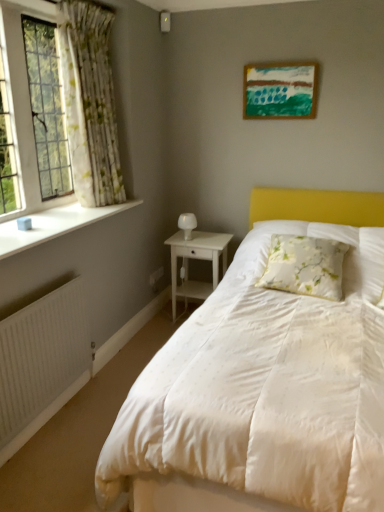
Locate an element on the screen. white glossy table lamp at center is located at coordinates (187, 224).

Measure the distance between floral fabric pillow at center and camera.

floral fabric pillow at center and camera are 2.33 meters apart from each other.

You are a GUI agent. You are given a task and a screenshot of the screen. Output one action in this format:
    pyautogui.click(x=<x>, y=<y>)
    Task: Click on the floral fabric pillow at center
    
    Given the screenshot: What is the action you would take?
    pyautogui.click(x=305, y=266)

This screenshot has height=512, width=384. Describe the element at coordinates (280, 90) in the screenshot. I see `wooden painted picture frame at upper center` at that location.

Locate an element on the screen. This screenshot has height=512, width=384. white wood nightstand at center is located at coordinates (196, 258).

In order to face white wood nightstand at center, should I rotate leftwards or rightwards?

To face it directly, rotate right by 1.165 degrees.

What are the coordinates of `clear glass window at left` in the screenshot? It's located at (25, 104).

Is point (177, 246) positioned in front of point (254, 104)?

No, it is not.

Does white wood nightstand at center have a lesser width compared to wooden painted picture frame at upper center?

No.

From a real-world perspective, is white wood nightstand at center over wooden painted picture frame at upper center?

No, from a real-world perspective, white wood nightstand at center is not above wooden painted picture frame at upper center.

Can you confirm if white wood nightstand at center is shorter than wooden painted picture frame at upper center?

Incorrect, the height of white wood nightstand at center does not fall short of that of wooden painted picture frame at upper center.

Based on the photo, is white floral fabric curtain at left outside of wooden painted picture frame at upper center?

Yes, white floral fabric curtain at left is outside of wooden painted picture frame at upper center.

From a real-world perspective, is white floral fabric curtain at left located beneath wooden painted picture frame at upper center?

Correct, in the physical world, white floral fabric curtain at left is lower than wooden painted picture frame at upper center.

Looking at this image, are white floral fabric curtain at left and wooden painted picture frame at upper center making contact?

white floral fabric curtain at left is not next to wooden painted picture frame at upper center, and they're not touching.

Based on the photo, in the image, is white wood nightstand at center positioned in front of or behind floral fabric pillow at center?

white wood nightstand at center is behind floral fabric pillow at center.

Which point is more forward, (178,231) or (329,271)?

The point (329,271) is more forward.

Is white wood nightstand at center inside the boundaries of floral fabric pillow at center, or outside?

The correct answer is: outside.

The image size is (384, 512). Find the location of `nightstand behind the floral fabric pillow at center`. nightstand behind the floral fabric pillow at center is located at coordinates (196, 258).

Is white wood nightstand at center facing towards white glossy table lamp at center?

No, white wood nightstand at center is not oriented towards white glossy table lamp at center.

Between white wood nightstand at center and white glossy table lamp at center, which one is positioned in front?

white wood nightstand at center.

Between white wood nightstand at center and white glossy table lamp at center, which one appears on the right side from the viewer's perspective?

From the viewer's perspective, white wood nightstand at center appears more on the right side.

Can you confirm if white wood nightstand at center is wider than white glossy table lamp at center?

Correct, the width of white wood nightstand at center exceeds that of white glossy table lamp at center.

Is wooden painted picture frame at upper center oriented towards white smooth window sill at left?

No, wooden painted picture frame at upper center does not turn towards white smooth window sill at left.

Consider the image. What's the angular difference between wooden painted picture frame at upper center and white smooth window sill at left's facing directions?

The angular difference between wooden painted picture frame at upper center and white smooth window sill at left is 89.7 degrees.

Considering the relative positions of wooden painted picture frame at upper center and white smooth window sill at left in the image provided, is wooden painted picture frame at upper center to the left or to the right of white smooth window sill at left?

From the image, it's evident that wooden painted picture frame at upper center is to the right of white smooth window sill at left.

From a real-world perspective, who is located lower, white ribbed radiator at lower left or white floral fabric curtain at left?

white ribbed radiator at lower left, from a real-world perspective.

Is white ribbed radiator at lower left smaller than white floral fabric curtain at left?

Yes.

Is white ribbed radiator at lower left further to the viewer compared to white floral fabric curtain at left?

No.

From the image's perspective, relative to white floral fabric curtain at left, is white ribbed radiator at lower left above or below?

From the image's perspective, white ribbed radiator at lower left appears below white floral fabric curtain at left.

What are the coordinates of `curtain lying above the white glossy table lamp at center (from the image's perspective)` in the screenshot? It's located at (90, 103).

Is white glossy table lamp at center far away from white floral fabric curtain at left?

Indeed, white glossy table lamp at center is not near white floral fabric curtain at left.

Considering the positions of point (194, 217) and point (62, 48), is point (194, 217) closer or farther from the camera than point (62, 48)?

Point (194, 217) is positioned farther from the camera compared to point (62, 48).

Where is `picture frame that is on the right side of white wood nightstand at center`? picture frame that is on the right side of white wood nightstand at center is located at coordinates (280, 90).

Where is `curtain that is under the wooden painted picture frame at upper center (from a real-world perspective)`? This screenshot has width=384, height=512. curtain that is under the wooden painted picture frame at upper center (from a real-world perspective) is located at coordinates (90, 103).

When comparing their distances from clear glass window at left, does white wood nightstand at center or wooden painted picture frame at upper center seem closer?

white wood nightstand at center is closer to clear glass window at left.

From the image, which object appears to be farther from white smooth window sill at left, white glossy table lamp at center or clear glass window at left?

The object further to white smooth window sill at left is white glossy table lamp at center.

Which object lies nearer to the anchor point white smooth window sill at left, floral fabric pillow at center or white wood nightstand at center?

The object closer to white smooth window sill at left is white wood nightstand at center.

From the image, which object appears to be nearer to white smooth window sill at left, wooden painted picture frame at upper center or white wood nightstand at center?

The object closer to white smooth window sill at left is white wood nightstand at center.

From the image, which object appears to be nearer to white glossy table lamp at center, clear glass window at left or wooden painted picture frame at upper center?

Among the two, wooden painted picture frame at upper center is located nearer to white glossy table lamp at center.

Considering their positions, is white floral fabric curtain at left positioned closer to white smooth window sill at left than clear glass window at left?

clear glass window at left lies closer to white smooth window sill at left than the other object.

Which object lies further to the anchor point white glossy table lamp at center, white smooth window sill at left or white floral fabric curtain at left?

Among the two, white floral fabric curtain at left is located further to white glossy table lamp at center.

Based on their spatial positions, is floral fabric pillow at center or white glossy table lamp at center further from white floral fabric curtain at left?

floral fabric pillow at center is positioned further to the anchor white floral fabric curtain at left.

You are a GUI agent. You are given a task and a screenshot of the screen. Output one action in this format:
    pyautogui.click(x=<x>, y=<y>)
    Task: Click on the nightstand between white ribbed radiator at lower left and white glossy table lamp at center in the front-back direction
    The height and width of the screenshot is (512, 384).
    Given the screenshot: What is the action you would take?
    pyautogui.click(x=196, y=258)

Identify the location of window sill positioned between white ribbed radiator at lower left and white glossy table lamp at center from near to far. (54, 225).

At what (x,y) coordinates should I click in order to perform the action: click on nightstand between white floral fabric curtain at left and white ribbed radiator at lower left in the up-down direction. Please return your answer as a coordinate pair (x, y). Image resolution: width=384 pixels, height=512 pixels. Looking at the image, I should click on (196, 258).

Where is `picture frame located between white floral fabric curtain at left and floral fabric pillow at center in the left-right direction`? This screenshot has height=512, width=384. picture frame located between white floral fabric curtain at left and floral fabric pillow at center in the left-right direction is located at coordinates (280, 90).